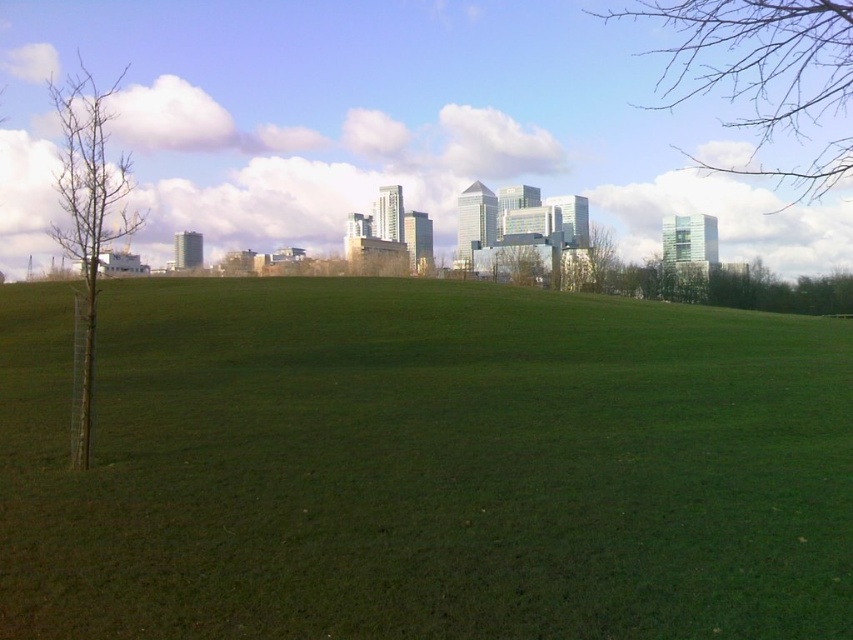
Question: Is the position of bare wood tree at left more distant than that of green leafy tree at center?

Choices:
 (A) yes
 (B) no

Answer: (B)

Question: Among these points, which one is nearest to the camera?

Choices:
 (A) (544, 273)
 (B) (73, 145)
 (C) (688, 68)

Answer: (B)

Question: Is green grass at center behind bare branches at upper right?

Choices:
 (A) yes
 (B) no

Answer: (B)

Question: Is the position of green grass at center less distant than that of bare branches at upper right?

Choices:
 (A) no
 (B) yes

Answer: (B)

Question: Which object is the farthest from the bare wood tree at left?

Choices:
 (A) green grass at center
 (B) green leafy tree at center
 (C) bare branches at upper right

Answer: (C)

Question: Which of the following is the farthest from the observer?

Choices:
 (A) green leafy tree at center
 (B) bare branches at upper right
 (C) green grass at center
 (D) bare wood tree at left

Answer: (A)